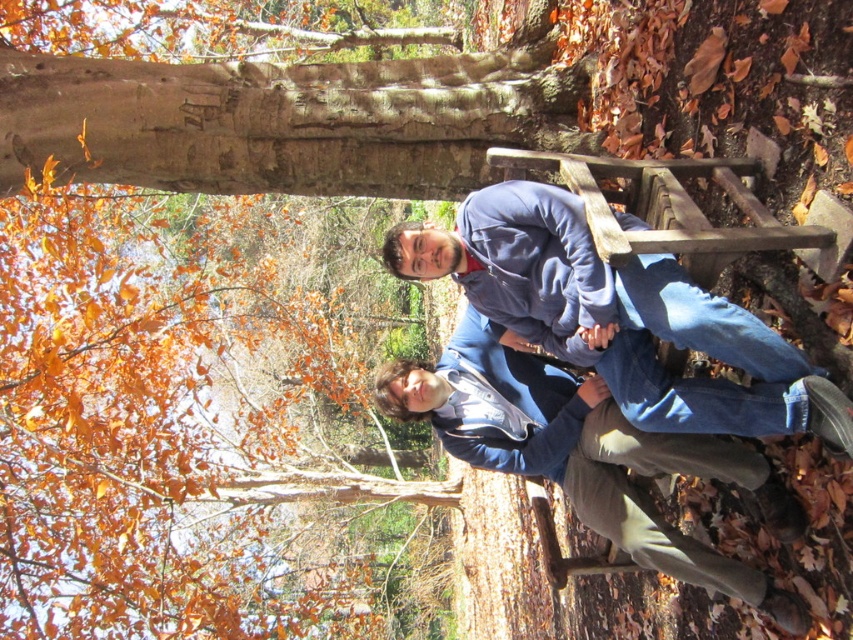
Who is positioned more to the left, blue fleece jacket at center or blue denim jacket at center?

blue fleece jacket at center is more to the left.

Who is taller, blue fleece jacket at center or blue denim jacket at center?

blue denim jacket at center is taller.

Who is more distant from viewer, (x=630, y=294) or (x=527, y=403)?

The point (x=527, y=403) is behind.

I want to click on blue fleece jacket at center, so click(619, 316).